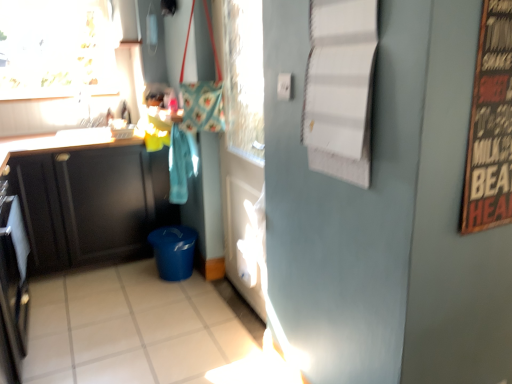
Question: Is black stainless steel oven at left situated inside white glossy tile at lower center or outside?

Choices:
 (A) inside
 (B) outside

Answer: (B)

Question: Relative to white glossy tile at lower center, is black stainless steel oven at left in front or behind?

Choices:
 (A) front
 (B) behind

Answer: (B)

Question: Which object is the farthest from the wooden signboard at right?

Choices:
 (A) black stainless steel oven at left
 (B) matte black cabinet at left, which appears as the 2th cabinetry when viewed from the front
 (C) transparent glass window at upper left
 (D) matte black cabinet at left, the first cabinetry from the front
 (E) white glossy door at center

Answer: (C)

Question: Estimate the real-world distances between objects in this image. Which object is closer to the transparent glass window at upper left?

Choices:
 (A) white glossy door at center
 (B) matte black cabinet at left, which is counted as the first cabinetry, starting from the back
 (C) matte black cabinet at left, the first cabinetry from the front
 (D) white glossy tile at lower center
 (E) wooden signboard at right

Answer: (C)